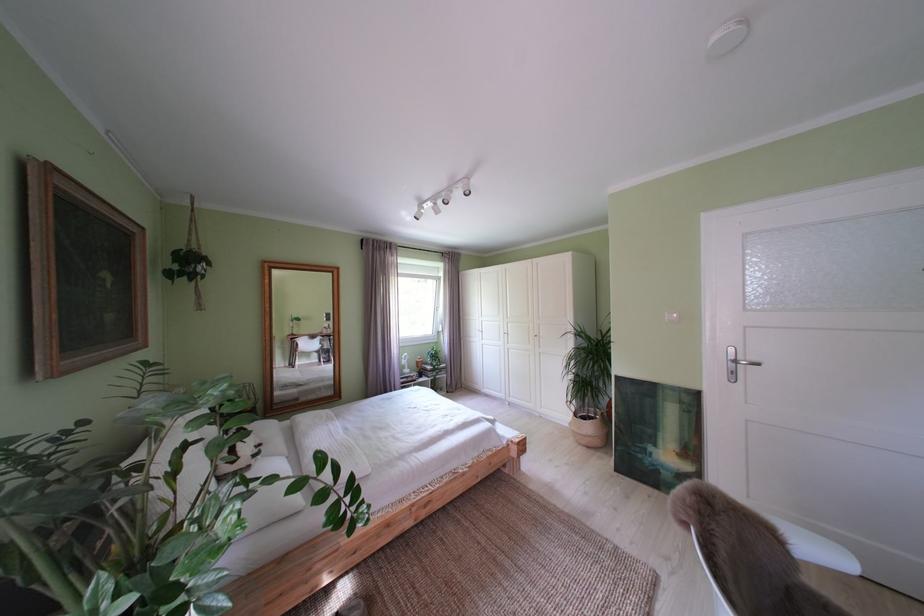
You are a GUI agent. You are given a task and a screenshot of the screen. Output one action in this format:
    pyautogui.click(x=<x>, y=<y>)
    Task: Click on the silver door handle
    This screenshot has width=924, height=616.
    Given the screenshot: What is the action you would take?
    pyautogui.click(x=736, y=363)